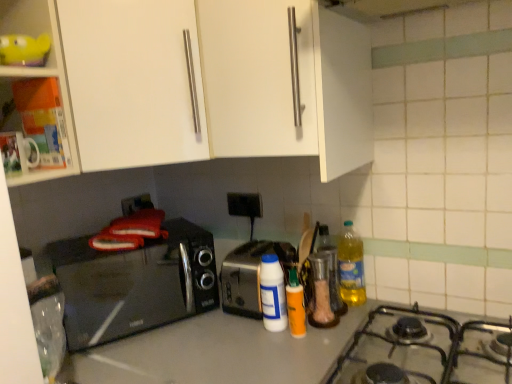
The width and height of the screenshot is (512, 384). What are the coordinates of `unoccupied area in front of translucent plastic bottle at center, the third bottle positioned from the left` in the screenshot? It's located at (325, 332).